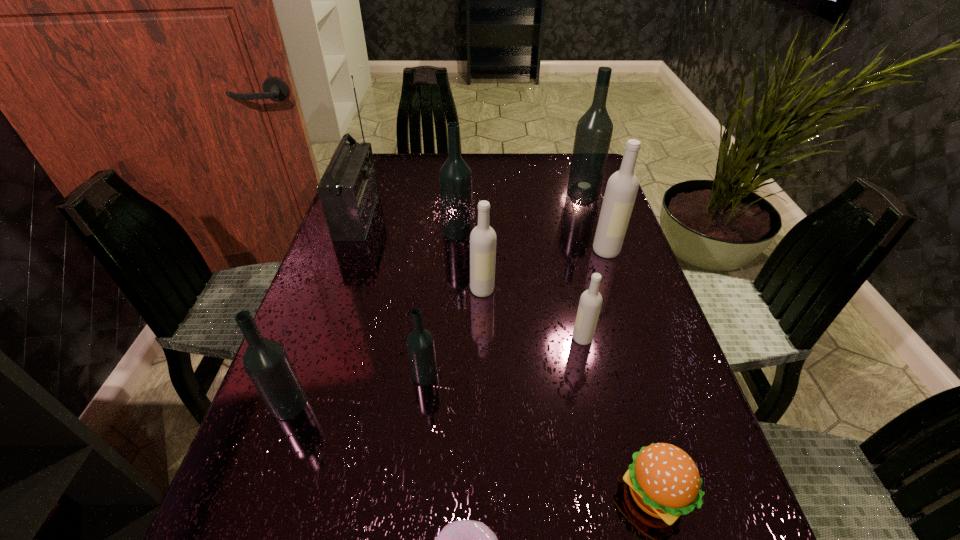
Locate an element on the screen. Image resolution: width=960 pixels, height=540 pixels. the nearest black vodka is located at coordinates (266, 362).

Where is `the second white vodka from left to right`? the second white vodka from left to right is located at coordinates (590, 303).

What are the coordinates of `the third vodka from right to left` in the screenshot? It's located at (590, 303).

Where is `the second nearest black vodka`? Image resolution: width=960 pixels, height=540 pixels. the second nearest black vodka is located at coordinates (420, 343).

At what (x,y) coordinates should I click in order to perform the action: click on the sixth farthest vodka. Please return your answer as a coordinate pair (x, y). Looking at the image, I should click on (420, 343).

Where is `hamburger`? This screenshot has height=540, width=960. hamburger is located at coordinates (664, 481).

In order to click on free space located 0.320m on the left of the farthest vodka in this screenshot , I will do `click(461, 193)`.

Where is `free space located 0.160m on the front panel of the radio receiver`? free space located 0.160m on the front panel of the radio receiver is located at coordinates (431, 216).

At what (x,y) coordinates should I click in order to perform the action: click on free spot located on the left of the rightmost white vodka. Please return your answer as a coordinate pair (x, y). The image size is (960, 540). Looking at the image, I should click on (515, 251).

I want to click on vacant space positioned 0.260m on the back of the second biggest black vodka, so click(x=461, y=174).